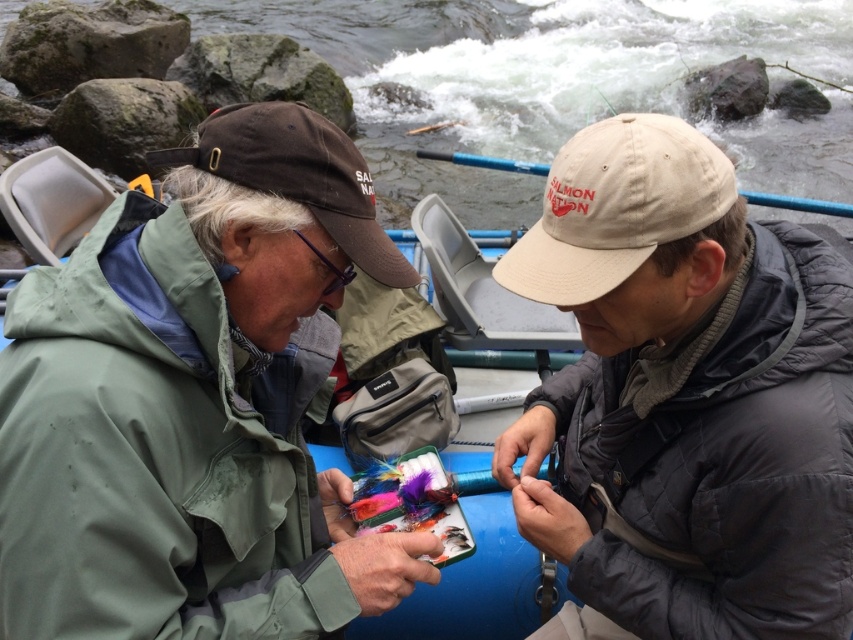
Question: Estimate the real-world distances between objects in this image. Which object is closer to the beige fabric cap at center?

Choices:
 (A) beige cotton cap at upper center
 (B) white frothy water at upper center

Answer: (A)

Question: Can you confirm if white frothy water at upper center is positioned to the right of brown fabric baseball cap at upper left?

Choices:
 (A) yes
 (B) no

Answer: (A)

Question: Among these points, which one is farthest from the camera?

Choices:
 (A) (328, 173)
 (B) (654, 596)
 (C) (633, 77)
 (D) (622, 195)

Answer: (C)

Question: Can you confirm if beige fabric cap at center is thinner than white frothy water at upper center?

Choices:
 (A) no
 (B) yes

Answer: (B)

Question: Is beige fabric cap at center above brown fabric baseball cap at upper left?

Choices:
 (A) yes
 (B) no

Answer: (B)

Question: Based on their relative distances, which object is nearer to the beige fabric cap at center?

Choices:
 (A) beige cotton cap at upper center
 (B) white frothy water at upper center

Answer: (A)